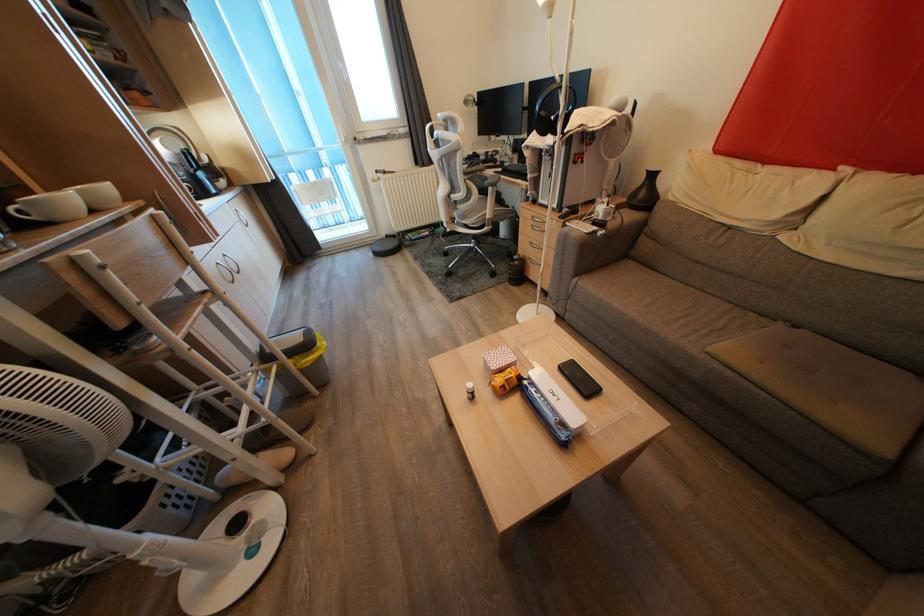
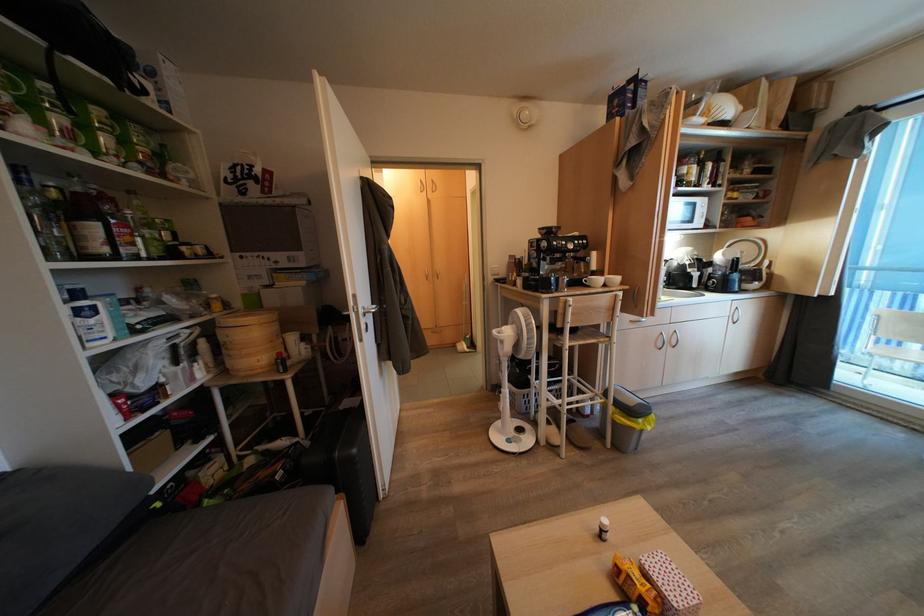
Locate, in the second image, the point that corresponds to the point at 324,352 in the first image.

(642, 428)